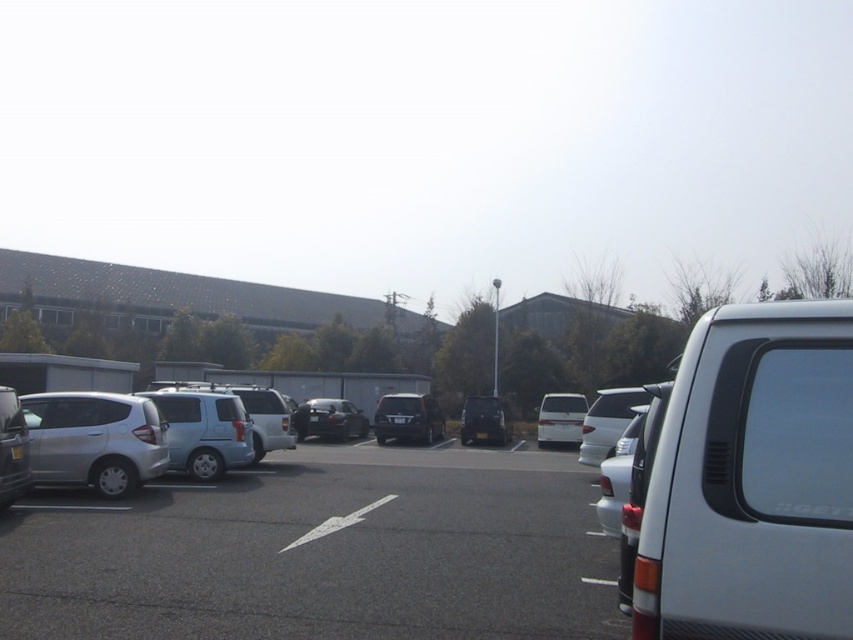
Question: Does silver metallic car at center appear over silver metallic sedan at left?

Choices:
 (A) no
 (B) yes

Answer: (A)

Question: Is silver metallic car at center closer to camera compared to satin black sedan at center?

Choices:
 (A) yes
 (B) no

Answer: (A)

Question: Which point is closer to the camera?

Choices:
 (A) satin black van at center
 (B) satin black sedan at center
 (C) satin silver car at left

Answer: (C)

Question: Does satin silver car at left have a greater width compared to satin black van at center?

Choices:
 (A) yes
 (B) no

Answer: (A)

Question: Which point is farther to the camera?

Choices:
 (A) satin black sedan at center
 (B) silver metallic sedan at left
 (C) white matte van at center
 (D) satin silver car at left

Answer: (A)

Question: Among these objects, which one is farthest from the camera?

Choices:
 (A) silver metallic car at center
 (B) satin silver van at right

Answer: (A)